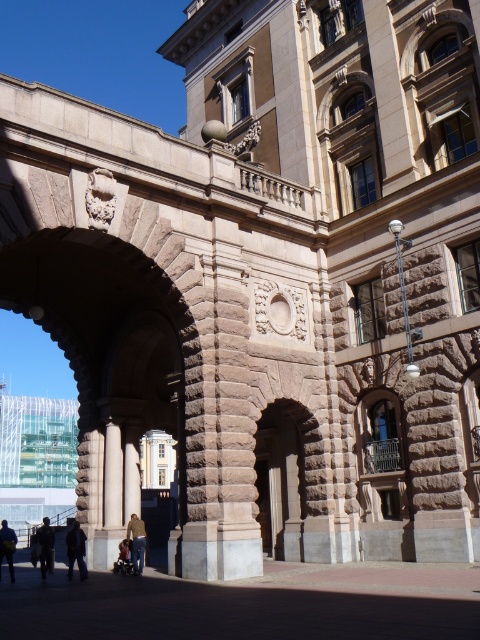
Is smooth stone pillar at center taller than dark brown leather jacket at lower center?

In fact, smooth stone pillar at center may be shorter than dark brown leather jacket at lower center.

Is smooth stone pillar at center wider than dark brown leather jacket at lower center?

Incorrect, smooth stone pillar at center's width does not surpass dark brown leather jacket at lower center's.

At what (x,y) coordinates should I click in order to perform the action: click on smooth stone pillar at center. Please return your answer as a coordinate pair (x, y). Looking at the image, I should click on (112, 476).

Which is in front, point (111, 492) or point (139, 474)?

Point (111, 492) is in front.

Can you confirm if smooth stone pillar at center is positioned to the right of brown stone pillar at center?

No, smooth stone pillar at center is not to the right of brown stone pillar at center.

Does point (108, 502) come in front of point (132, 426)?

Yes.

Identify the location of smooth stone pillar at center. The image size is (480, 640). (112, 476).

Which is more to the left, smooth stone pillar at center or dark gray fabric jacket at lower left?

dark gray fabric jacket at lower left

Does point (116, 436) come in front of point (49, 525)?

Yes, it is.

This screenshot has width=480, height=640. What do you see at coordinates (112, 476) in the screenshot?
I see `smooth stone pillar at center` at bounding box center [112, 476].

Image resolution: width=480 pixels, height=640 pixels. Find the location of `smooth stone pillar at center`. smooth stone pillar at center is located at coordinates [x=112, y=476].